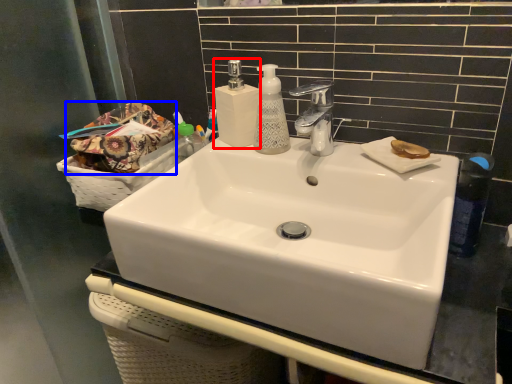
Question: Which object is further to the camera taking this photo, soap dispenser (highlighted by a red box) or material (highlighted by a blue box)?

Choices:
 (A) soap dispenser
 (B) material

Answer: (A)